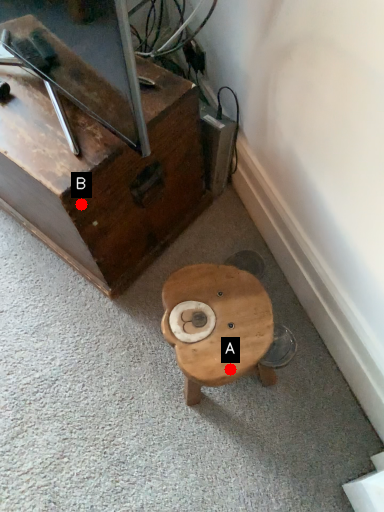
Question: Two points are circled on the image, labeled by A and B beside each circle. Among these points, which one is farthest from the camera?

Choices:
 (A) A is further
 (B) B is further

Answer: (B)